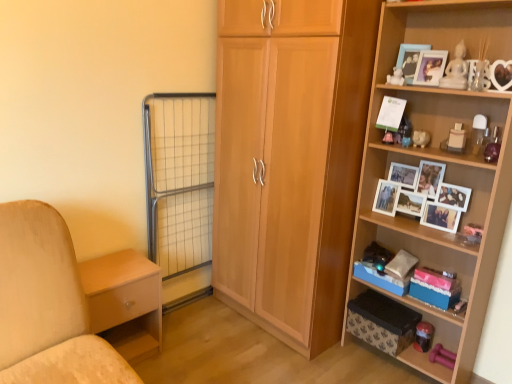
Question: Is wooden shelf at right, the 1th shelf ordered from the bottom, at the left side of white matte bear at upper right, arranged as the 2th toy when viewed from the top?

Choices:
 (A) yes
 (B) no

Answer: (B)

Question: Is wooden shelf at right, the second shelf in the top-to-bottom sequence, taller than white matte bear at upper right, placed as the 2th toy when sorted from back to front?

Choices:
 (A) yes
 (B) no

Answer: (A)

Question: Considering the relative sizes of wooden shelf at right, the second shelf in the top-to-bottom sequence, and white matte bear at upper right, acting as the 1th toy starting from the left, in the image provided, is wooden shelf at right, the second shelf in the top-to-bottom sequence, smaller than white matte bear at upper right, acting as the 1th toy starting from the left,?

Choices:
 (A) yes
 (B) no

Answer: (B)

Question: Is wooden shelf at right, the second shelf in the top-to-bottom sequence, not inside white matte bear at upper right, positioned as the third toy in right-to-left order?

Choices:
 (A) yes
 (B) no

Answer: (A)

Question: Does wooden shelf at right, the 1th shelf ordered from the bottom, come behind white matte bear at upper right, arranged as the 2th toy when viewed from the top?

Choices:
 (A) yes
 (B) no

Answer: (B)

Question: Is wooden shelf at right, the 1th shelf ordered from the bottom, looking in the opposite direction of white matte bear at upper right, acting as the second toy starting from the bottom?

Choices:
 (A) yes
 (B) no

Answer: (A)

Question: Is pink fabric storage box at lower right, the 2th storage box when ordered from top to bottom, thinner than blue cardboard storage box at lower right, the 1th storage box when ordered from top to bottom?

Choices:
 (A) yes
 (B) no

Answer: (A)

Question: From the image's perspective, is pink fabric storage box at lower right, which is the second storage box from bottom to top, under blue cardboard storage box at lower right, which appears as the 3th storage box when ordered from the bottom?

Choices:
 (A) no
 (B) yes

Answer: (B)

Question: Is pink fabric storage box at lower right, which is the second storage box from bottom to top, smaller than blue cardboard storage box at lower right, the 1th storage box when ordered from top to bottom?

Choices:
 (A) yes
 (B) no

Answer: (A)

Question: Considering the relative sizes of pink fabric storage box at lower right, which is the second storage box from bottom to top, and blue cardboard storage box at lower right, the 1th storage box when ordered from top to bottom, in the image provided, is pink fabric storage box at lower right, which is the second storage box from bottom to top, shorter than blue cardboard storage box at lower right, the 1th storage box when ordered from top to bottom,?

Choices:
 (A) no
 (B) yes

Answer: (A)

Question: Is pink fabric storage box at lower right, which is the second storage box from bottom to top, located outside blue cardboard storage box at lower right, the 1th storage box when ordered from top to bottom?

Choices:
 (A) no
 (B) yes

Answer: (B)

Question: From a real-world perspective, is pink fabric storage box at lower right, the 2th storage box when ordered from top to bottom, positioned over blue cardboard storage box at lower right, the 1th storage box when ordered from top to bottom, based on gravity?

Choices:
 (A) yes
 (B) no

Answer: (A)

Question: Is white matte bear at upper right, placed as the 2th toy when sorted from back to front, far from wooden photo frame at upper right, the second picture frame in the right-to-left sequence?

Choices:
 (A) no
 (B) yes

Answer: (A)